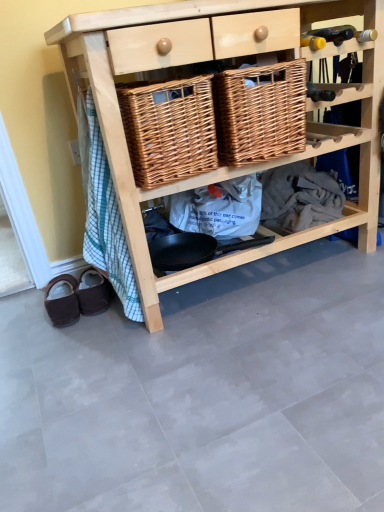
Image resolution: width=384 pixels, height=512 pixels. What do you see at coordinates (62, 300) in the screenshot?
I see `brown suede slippers at lower left, which is the 1th footwear in left-to-right order` at bounding box center [62, 300].

Image resolution: width=384 pixels, height=512 pixels. Find the location of `brown suede mule at lower left, which is counted as the second footwear, starting from the left`. brown suede mule at lower left, which is counted as the second footwear, starting from the left is located at coordinates (93, 292).

What's the angular difference between brown suede slippers at lower left, which is the 1th footwear in left-to-right order, and natural wood shelf at center's facing directions?

They differ by 15.7 degrees in their facing directions.

Which is behind, point (68, 281) or point (118, 195)?

The point (68, 281) is behind.

Which object is further away from the camera taking this photo, brown suede slippers at lower left, which is the 1th footwear in left-to-right order, or natural wood shelf at center?

brown suede slippers at lower left, which is the 1th footwear in left-to-right order.

In the scene shown: Between brown suede slippers at lower left, the second footwear from the right, and natural wood shelf at center, which one has larger width?

natural wood shelf at center.

Does natural wood shelf at center have a lesser width compared to brown suede mule at lower left, which is counted as the second footwear, starting from the left?

No, natural wood shelf at center is not thinner than brown suede mule at lower left, which is counted as the second footwear, starting from the left.

Is brown suede mule at lower left, which is counted as the second footwear, starting from the left, located within natural wood shelf at center?

No, brown suede mule at lower left, which is counted as the second footwear, starting from the left, is not surrounded by natural wood shelf at center.

Considering the sizes of objects natural wood shelf at center and brown suede mule at lower left, which is counted as the first footwear, starting from the right, in the image provided, who is bigger, natural wood shelf at center or brown suede mule at lower left, which is counted as the first footwear, starting from the right,?

Bigger between the two is natural wood shelf at center.

Which of these two, natural wood shelf at center or brown suede mule at lower left, which is counted as the first footwear, starting from the right, stands shorter?

brown suede mule at lower left, which is counted as the first footwear, starting from the right, is shorter.

Is point (55, 28) farther from viewer compared to point (76, 298)?

No, it is not.

Would you consider natural wood shelf at center to be distant from brown suede slippers at lower left, the second footwear from the right?

natural wood shelf at center is actually quite close to brown suede slippers at lower left, the second footwear from the right.

Between natural wood shelf at center and brown suede slippers at lower left, which is the 1th footwear in left-to-right order, which one appears on the right side from the viewer's perspective?

natural wood shelf at center is more to the right.

How different are the orientations of woven brown basket at center, which is counted as the first basket, starting from the left, and woven brown basket at center, acting as the second basket starting from the left, in degrees?

0.000578 degrees separate the facing orientations of woven brown basket at center, which is counted as the first basket, starting from the left, and woven brown basket at center, acting as the second basket starting from the left.

From a real-world perspective, is woven brown basket at center, which is counted as the first basket, starting from the left, physically above woven brown basket at center, acting as the second basket starting from the left?

No, from a real-world perspective, woven brown basket at center, which is counted as the first basket, starting from the left, is not above woven brown basket at center, acting as the second basket starting from the left.

Between woven brown basket at center, which is counted as the first basket, starting from the left, and woven brown basket at center, the first basket viewed from the right, which one is positioned behind?

Positioned behind is woven brown basket at center, the first basket viewed from the right.

Is point (149, 111) closer or farther from the camera than point (266, 87)?

Point (149, 111).

Identify the location of the 1st basket counting from the left of the natural wood shelf at center. The image size is (384, 512). (260, 112).

From a real-world perspective, is natural wood shelf at center positioned above or below woven brown basket at center, acting as the second basket starting from the left?

natural wood shelf at center is below woven brown basket at center, acting as the second basket starting from the left.

Can you confirm if natural wood shelf at center is thinner than woven brown basket at center, the first basket viewed from the right?

No.

Is natural wood shelf at center at the left side of woven brown basket at center, the first basket viewed from the right?

No.

Between woven brown basket at center, marked as the second basket in a right-to-left arrangement, and brown suede mule at lower left, which is counted as the second footwear, starting from the left, which one has smaller width?

brown suede mule at lower left, which is counted as the second footwear, starting from the left.

Who is shorter, woven brown basket at center, which is counted as the first basket, starting from the left, or brown suede mule at lower left, which is counted as the first footwear, starting from the right?

brown suede mule at lower left, which is counted as the first footwear, starting from the right.

Is woven brown basket at center, which is counted as the first basket, starting from the left, closer to camera compared to brown suede mule at lower left, which is counted as the first footwear, starting from the right?

Yes, woven brown basket at center, which is counted as the first basket, starting from the left, is in front of brown suede mule at lower left, which is counted as the first footwear, starting from the right.

Considering the points (156, 92) and (106, 284), which point is in front, point (156, 92) or point (106, 284)?

Point (156, 92)

Does brown suede mule at lower left, which is counted as the first footwear, starting from the right, have a greater width compared to woven brown basket at center, the first basket viewed from the right?

In fact, brown suede mule at lower left, which is counted as the first footwear, starting from the right, might be narrower than woven brown basket at center, the first basket viewed from the right.

From a real-world perspective, which is physically above, brown suede mule at lower left, which is counted as the first footwear, starting from the right, or woven brown basket at center, acting as the second basket starting from the left?

woven brown basket at center, acting as the second basket starting from the left.

Does brown suede mule at lower left, which is counted as the second footwear, starting from the left, have a larger size compared to woven brown basket at center, acting as the second basket starting from the left?

Actually, brown suede mule at lower left, which is counted as the second footwear, starting from the left, might be smaller than woven brown basket at center, acting as the second basket starting from the left.

Does brown suede mule at lower left, which is counted as the second footwear, starting from the left, turn towards woven brown basket at center, acting as the second basket starting from the left?

No, brown suede mule at lower left, which is counted as the second footwear, starting from the left, does not turn towards woven brown basket at center, acting as the second basket starting from the left.

Identify the location of shelf above the brown suede slippers at lower left, the second footwear from the right (from a real-world perspective). (207, 59).

This screenshot has height=512, width=384. What are the coordinates of `the 2nd footwear behind the natural wood shelf at center, counting from the anchor's position` in the screenshot? It's located at (93, 292).

Based on their spatial positions, is woven brown basket at center, the first basket viewed from the right, or natural wood shelf at center further from brown suede mule at lower left, which is counted as the second footwear, starting from the left?

woven brown basket at center, the first basket viewed from the right, lies further to brown suede mule at lower left, which is counted as the second footwear, starting from the left, than the other object.

Looking at the image, which one is located further to brown suede mule at lower left, which is counted as the first footwear, starting from the right, natural wood shelf at center or woven brown basket at center, which is counted as the first basket, starting from the left?

natural wood shelf at center is further to brown suede mule at lower left, which is counted as the first footwear, starting from the right.

Estimate the real-world distances between objects in this image. Which object is closer to woven brown basket at center, acting as the second basket starting from the left, natural wood shelf at center or brown suede mule at lower left, which is counted as the first footwear, starting from the right?

natural wood shelf at center.

When comparing their distances from natural wood shelf at center, does woven brown basket at center, marked as the second basket in a right-to-left arrangement, or woven brown basket at center, the first basket viewed from the right, seem further?

The object further to natural wood shelf at center is woven brown basket at center, marked as the second basket in a right-to-left arrangement.

Based on their spatial positions, is brown suede mule at lower left, which is counted as the second footwear, starting from the left, or brown suede slippers at lower left, the second footwear from the right, closer to woven brown basket at center, which is counted as the first basket, starting from the left?

Based on the image, brown suede mule at lower left, which is counted as the second footwear, starting from the left, appears to be nearer to woven brown basket at center, which is counted as the first basket, starting from the left.

When comparing their distances from natural wood shelf at center, does woven brown basket at center, the first basket viewed from the right, or brown suede mule at lower left, which is counted as the first footwear, starting from the right, seem closer?

The object closer to natural wood shelf at center is woven brown basket at center, the first basket viewed from the right.

Considering their positions, is brown suede mule at lower left, which is counted as the second footwear, starting from the left, positioned further to natural wood shelf at center than woven brown basket at center, marked as the second basket in a right-to-left arrangement?

brown suede mule at lower left, which is counted as the second footwear, starting from the left, is further to natural wood shelf at center.

When comparing their distances from brown suede slippers at lower left, the second footwear from the right, does natural wood shelf at center or woven brown basket at center, which is counted as the first basket, starting from the left, seem closer?

woven brown basket at center, which is counted as the first basket, starting from the left, lies closer to brown suede slippers at lower left, the second footwear from the right, than the other object.

The width and height of the screenshot is (384, 512). In order to click on footwear that lies between woven brown basket at center, which is counted as the first basket, starting from the left, and brown suede slippers at lower left, which is the 1th footwear in left-to-right order, from top to bottom in this screenshot , I will do `click(93, 292)`.

The width and height of the screenshot is (384, 512). I want to click on basket between woven brown basket at center, the first basket viewed from the right, and brown suede slippers at lower left, the second footwear from the right, vertically, so click(x=169, y=129).

Locate an element on the screen. This screenshot has height=512, width=384. shelf that lies between woven brown basket at center, acting as the second basket starting from the left, and brown suede mule at lower left, which is counted as the second footwear, starting from the left, from top to bottom is located at coordinates (207, 59).

The height and width of the screenshot is (512, 384). In order to click on basket between woven brown basket at center, which is counted as the first basket, starting from the left, and natural wood shelf at center in this screenshot , I will do `click(260, 112)`.